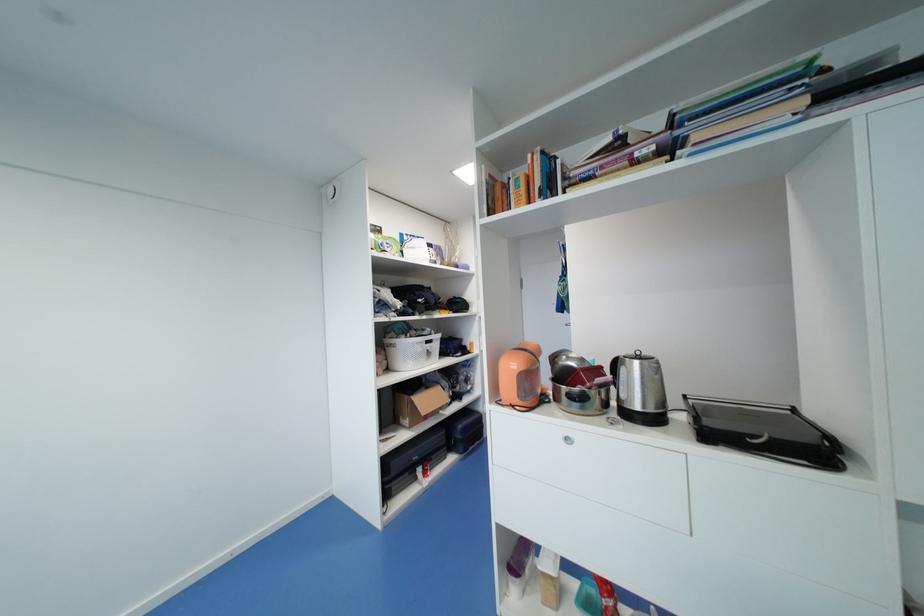
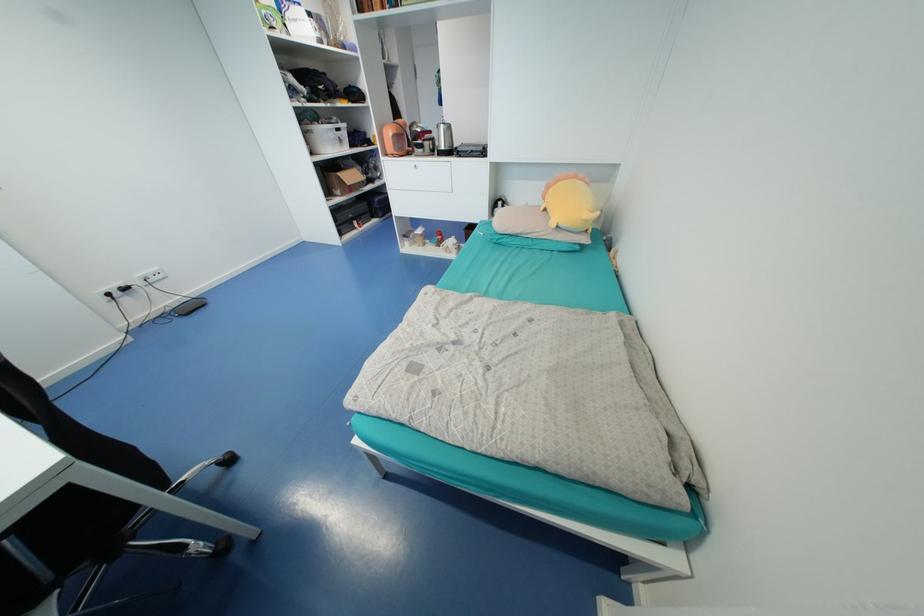
The point at (408, 419) is marked in the first image. Where is the corresponding point in the second image?

(341, 190)